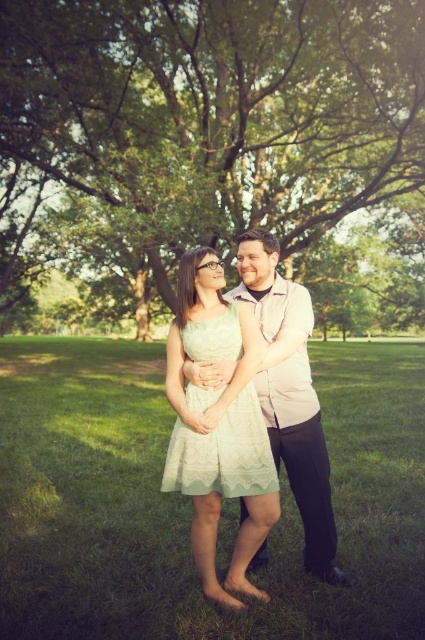
Question: Which object is farther from the camera taking this photo?

Choices:
 (A) light green lace dress at center
 (B) lace fabric dress at center
 (C) green leafy tree at center

Answer: (C)

Question: Which point is closer to the camera taking this photo?

Choices:
 (A) (397, 381)
 (B) (311, 451)
 (C) (201, 444)

Answer: (C)

Question: Does green grass at center appear on the right side of light green lace dress at center?

Choices:
 (A) yes
 (B) no

Answer: (A)

Question: Can you confirm if green leafy tree at center is wider than green grass at center?

Choices:
 (A) yes
 (B) no

Answer: (A)

Question: Which is farther from the light green lace dress at center?

Choices:
 (A) lace fabric dress at center
 (B) green leafy tree at center

Answer: (B)

Question: Is green leafy tree at center bigger than light green lace dress at center?

Choices:
 (A) no
 (B) yes

Answer: (B)